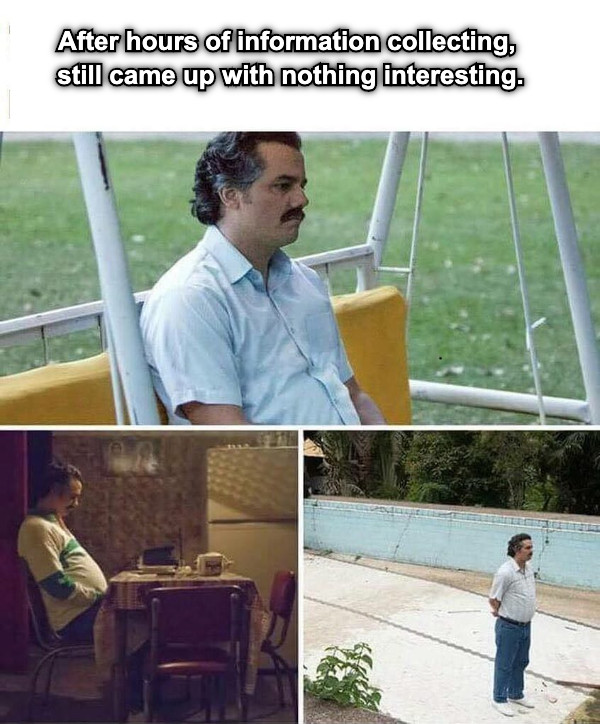
The height and width of the screenshot is (724, 600). What are the coordinates of `napkin holder` in the screenshot? It's located at (212, 565).